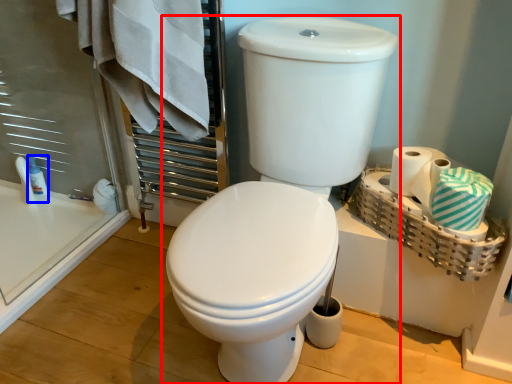
Question: Which point is further to the camera, toilet (highlighted by a red box) or toiletry (highlighted by a blue box)?

Choices:
 (A) toilet
 (B) toiletry

Answer: (B)